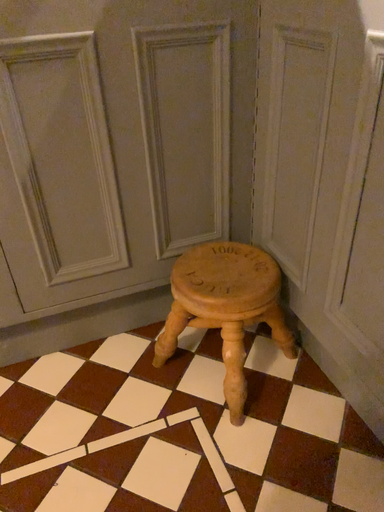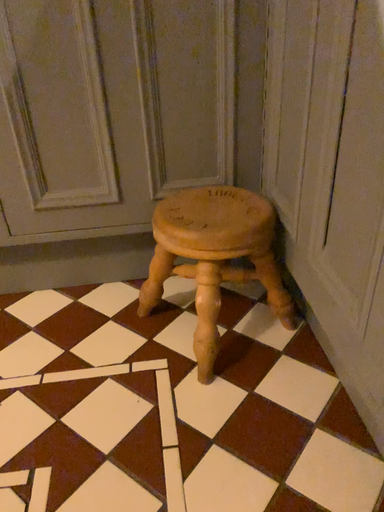
Question: How did the camera likely rotate when shooting the video?

Choices:
 (A) rotated right
 (B) rotated left

Answer: (B)